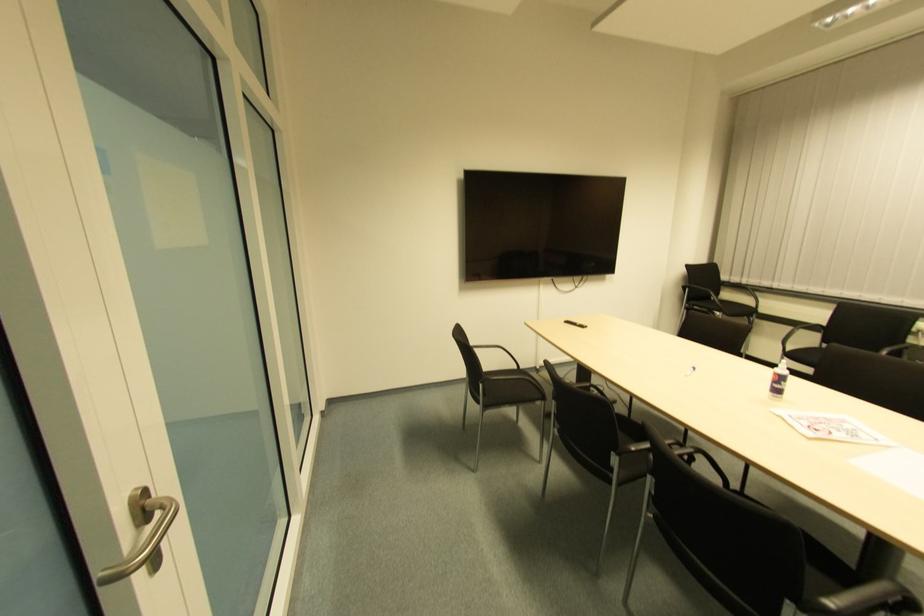
Identify the location of chair armrest. The image size is (924, 616). pyautogui.click(x=699, y=296).